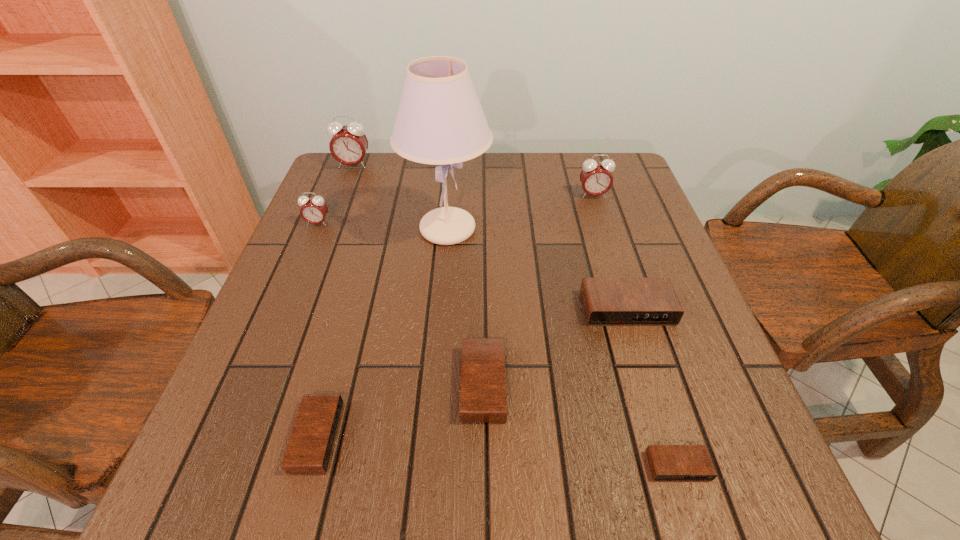
Identify the location of the fourth alarm clock from left to right. Image resolution: width=960 pixels, height=540 pixels. (483, 399).

At what (x,y) coordinates should I click in order to perform the action: click on the leftmost black alarm clock. Please return your answer as a coordinate pair (x, y). The width and height of the screenshot is (960, 540). Looking at the image, I should click on (310, 445).

You are a GUI agent. You are given a task and a screenshot of the screen. Output one action in this format:
    pyautogui.click(x=<x>, y=<y>)
    Task: Click on the third biggest black alarm clock
    This screenshot has height=540, width=960.
    Given the screenshot: What is the action you would take?
    pyautogui.click(x=310, y=445)

I want to click on the shortest object, so click(667, 462).

Locate an element on the screen. This screenshot has height=540, width=960. the shortest alarm clock is located at coordinates (667, 462).

This screenshot has width=960, height=540. I want to click on free space located on the back of the tallest object, so click(x=452, y=180).

The height and width of the screenshot is (540, 960). Identify the location of vacant area located on the clock face of the farthest alarm clock. tap(337, 207).

The width and height of the screenshot is (960, 540). I want to click on vacant space located 0.170m on the clock face of the second biggest pink alarm clock, so click(608, 241).

Where is `free space located on the clock face of the smallest pink alarm clock`? free space located on the clock face of the smallest pink alarm clock is located at coordinates (258, 364).

Locate an element on the screen. vacant space located on the front face of the fifth farthest object is located at coordinates (684, 491).